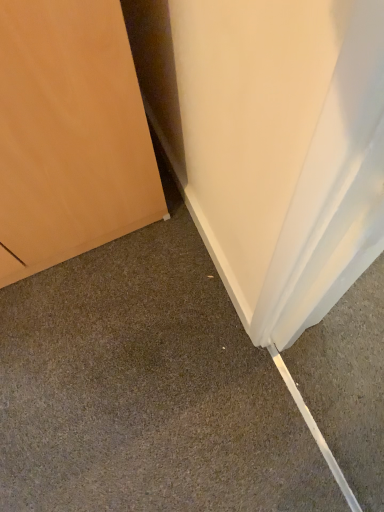
Locate an element on the screen. Image resolution: width=384 pixels, height=512 pixels. matte wood door at lower left is located at coordinates (146, 390).

The height and width of the screenshot is (512, 384). What do you see at coordinates (146, 390) in the screenshot?
I see `matte wood door at lower left` at bounding box center [146, 390].

I want to click on matte wood door at lower left, so click(x=146, y=390).